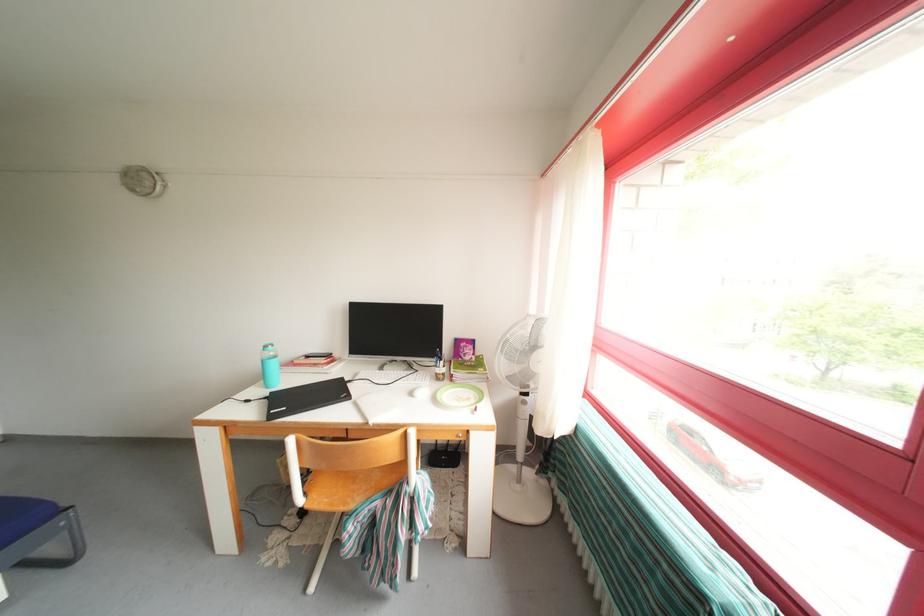
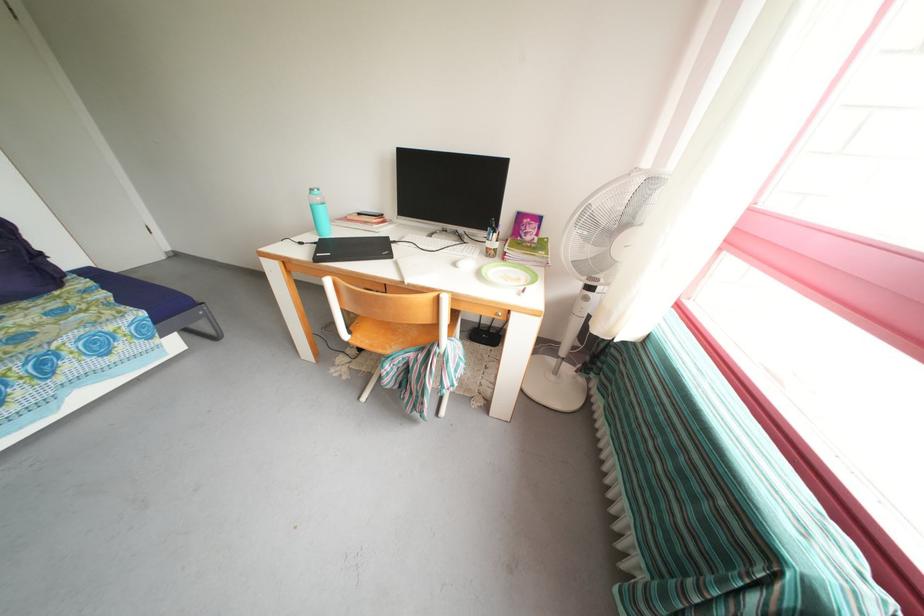
Question: The images are taken continuously from a first-person perspective. In which direction is your viewpoint rotating?

Choices:
 (A) Left
 (B) Right
 (C) Up
 (D) Down

Answer: (D)